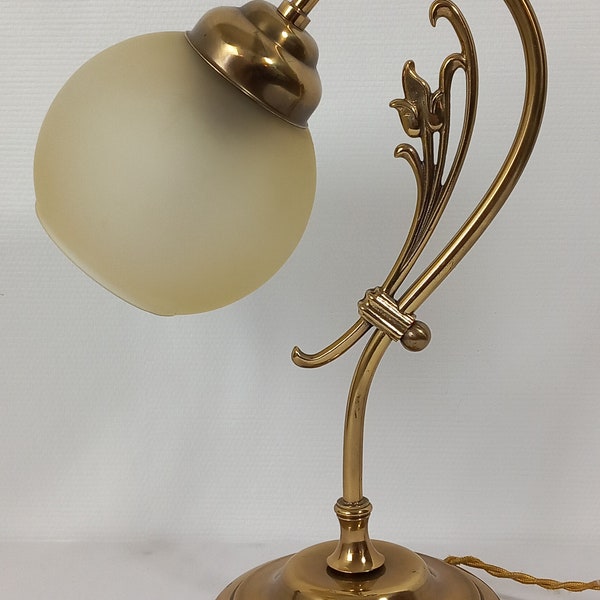
Locate where arm screws into base in the image. Your answer should be formatted as a list of tuples, i.e. [(x1, y1), (x2, y2), ...], where each tuple contains the x and y coordinates of a point satisfying the conditions above.

[(360, 552)]